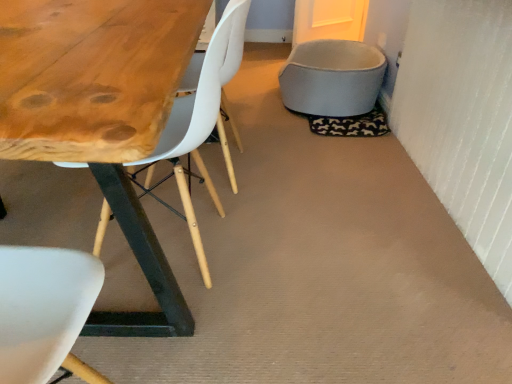
Question: Is white matte chair at center to the left or to the right of white plastic chair at upper left in the image?

Choices:
 (A) left
 (B) right

Answer: (B)

Question: From their relative heights in the image, would you say white matte chair at center is taller or shorter than white plastic chair at upper left?

Choices:
 (A) short
 (B) tall

Answer: (A)

Question: Which object is positioned farthest from the white matte chair at center?

Choices:
 (A) white plastic chair at upper left
 (B) soft fabric pet bed at upper right

Answer: (B)

Question: Estimate the real-world distances between objects in this image. Which object is farther from the white matte chair at center?

Choices:
 (A) white plastic chair at upper left
 (B) soft fabric pet bed at upper right

Answer: (B)